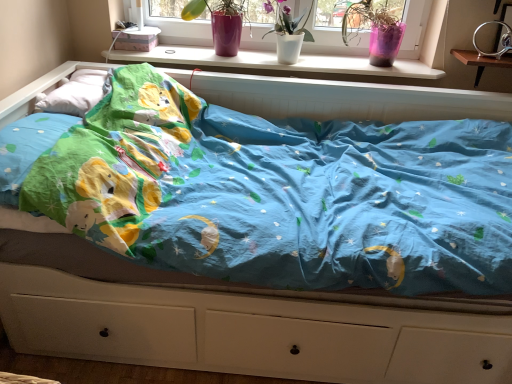
Describe the element at coordinates (287, 21) in the screenshot. I see `white matte vase at upper center, which is counted as the 2th floral arrangement, starting from the right` at that location.

Find the location of a particular element. This screenshot has height=384, width=512. white soft pillow at upper left is located at coordinates (75, 93).

At what (x,y) coordinates should I click in order to perform the action: click on white matte vase at upper center, which is counted as the 2th floral arrangement, starting from the right. Please return your answer as a coordinate pair (x, y). This screenshot has width=512, height=384. Looking at the image, I should click on (287, 21).

How different are the orientations of white plastic window sill at upper center and white soft pillow at upper left in degrees?

The angle between the facing direction of white plastic window sill at upper center and the facing direction of white soft pillow at upper left is 89.4 degrees.

Is the surface of white plastic window sill at upper center in direct contact with white soft pillow at upper left?

white plastic window sill at upper center and white soft pillow at upper left are clearly separated.

Is white plastic window sill at upper center taller or shorter than white soft pillow at upper left?

Considering their sizes, white plastic window sill at upper center has less height than white soft pillow at upper left.

Can you confirm if white plastic window sill at upper center is positioned to the left of white soft pillow at upper left?

No, white plastic window sill at upper center is not to the left of white soft pillow at upper left.

Considering the relative sizes of white matte vase at upper center, arranged as the 2th floral arrangement when viewed from the left, and white plastic window sill at upper center in the image provided, is white matte vase at upper center, arranged as the 2th floral arrangement when viewed from the left, smaller than white plastic window sill at upper center?

Correct, white matte vase at upper center, arranged as the 2th floral arrangement when viewed from the left, occupies less space than white plastic window sill at upper center.

From the image's perspective, which is below, white matte vase at upper center, arranged as the 2th floral arrangement when viewed from the left, or white plastic window sill at upper center?

white plastic window sill at upper center.

Can you confirm if white matte vase at upper center, arranged as the 2th floral arrangement when viewed from the left, is taller than white plastic window sill at upper center?

Yes.

Choose the correct answer: Is white matte vase at upper center, which is counted as the 2th floral arrangement, starting from the right, inside white plastic window sill at upper center or outside it?

white matte vase at upper center, which is counted as the 2th floral arrangement, starting from the right, cannot be found inside white plastic window sill at upper center.

Is white matte vase at upper center, which is counted as the 2th floral arrangement, starting from the right, smaller than pink plastic pot at upper right, which is the first floral arrangement from right to left?

Yes, white matte vase at upper center, which is counted as the 2th floral arrangement, starting from the right, is smaller than pink plastic pot at upper right, which is the first floral arrangement from right to left.

Which point is more distant from viewer, [306,41] or [348,38]?

The point [348,38] is behind.

Which is in front, white matte vase at upper center, arranged as the 2th floral arrangement when viewed from the left, or pink plastic pot at upper right, marked as the 3th floral arrangement in a left-to-right arrangement?

white matte vase at upper center, arranged as the 2th floral arrangement when viewed from the left.

Can you confirm if white matte vase at upper center, arranged as the 2th floral arrangement when viewed from the left, is wider than pink plastic pot at upper right, which is the first floral arrangement from right to left?

In fact, white matte vase at upper center, arranged as the 2th floral arrangement when viewed from the left, might be narrower than pink plastic pot at upper right, which is the first floral arrangement from right to left.

Does point (229, 38) come farther from viewer compared to point (477, 62)?

That is True.

Could you tell me if matte pink vase at upper center, arranged as the first floral arrangement when viewed from the left, is turned towards wooden changing table at upper right?

No, matte pink vase at upper center, arranged as the first floral arrangement when viewed from the left, is not aimed at wooden changing table at upper right.

Does matte pink vase at upper center, the third floral arrangement from the right, have a greater width compared to white plastic window sill at upper center?

Correct, the width of matte pink vase at upper center, the third floral arrangement from the right, exceeds that of white plastic window sill at upper center.

Does matte pink vase at upper center, arranged as the first floral arrangement when viewed from the left, appear on the right side of white plastic window sill at upper center?

In fact, matte pink vase at upper center, arranged as the first floral arrangement when viewed from the left, is to the left of white plastic window sill at upper center.

Could you tell me if matte pink vase at upper center, arranged as the first floral arrangement when viewed from the left, is facing white plastic window sill at upper center?

No, matte pink vase at upper center, arranged as the first floral arrangement when viewed from the left, is not aimed at white plastic window sill at upper center.

Measure the distance from matte pink vase at upper center, arranged as the first floral arrangement when viewed from the left, to white plastic window sill at upper center.

matte pink vase at upper center, arranged as the first floral arrangement when viewed from the left, and white plastic window sill at upper center are 23.45 centimeters apart from each other.

Which is less distant, (290, 70) or (490, 59)?

The point (490, 59) is closer.

Looking at this image, which object is closer to the camera, white plastic window sill at upper center or wooden changing table at upper right?

wooden changing table at upper right is more forward.

How much distance is there between white plastic window sill at upper center and wooden changing table at upper right?

They are 21.65 inches apart.

The width and height of the screenshot is (512, 384). Identify the location of window sill located above the wooden changing table at upper right (from the image's perspective). (274, 63).

Which of these two, pink plastic pot at upper right, which is the first floral arrangement from right to left, or matte pink vase at upper center, arranged as the first floral arrangement when viewed from the left, is wider?

matte pink vase at upper center, arranged as the first floral arrangement when viewed from the left, is wider.

Is pink plastic pot at upper right, which is the first floral arrangement from right to left, outside of matte pink vase at upper center, the third floral arrangement from the right?

Yes, pink plastic pot at upper right, which is the first floral arrangement from right to left, is located beyond the bounds of matte pink vase at upper center, the third floral arrangement from the right.

From a real-world perspective, does pink plastic pot at upper right, which is the first floral arrangement from right to left, stand above matte pink vase at upper center, arranged as the first floral arrangement when viewed from the left?

Indeed, from a real-world perspective, pink plastic pot at upper right, which is the first floral arrangement from right to left, stands above matte pink vase at upper center, arranged as the first floral arrangement when viewed from the left.

This screenshot has width=512, height=384. Identify the location of window sill behind the white soft pillow at upper left. (274, 63).

Locate an element on the screen. Image resolution: width=512 pixels, height=384 pixels. the 2nd floral arrangement in front of the white plastic window sill at upper center is located at coordinates (287, 21).

Looking at the image, which one is located further to matte pink vase at upper center, the third floral arrangement from the right, white plastic window sill at upper center or wooden changing table at upper right?

The object further to matte pink vase at upper center, the third floral arrangement from the right, is wooden changing table at upper right.

When comparing their distances from matte pink vase at upper center, the third floral arrangement from the right, does pink plastic pot at upper right, which is the first floral arrangement from right to left, or white matte vase at upper center, which is counted as the 2th floral arrangement, starting from the right, seem further?

Among the two, pink plastic pot at upper right, which is the first floral arrangement from right to left, is located further to matte pink vase at upper center, the third floral arrangement from the right.

From the image, which object appears to be nearer to white soft pillow at upper left, pink plastic pot at upper right, marked as the 3th floral arrangement in a left-to-right arrangement, or wooden changing table at upper right?

Among the two, pink plastic pot at upper right, marked as the 3th floral arrangement in a left-to-right arrangement, is located nearer to white soft pillow at upper left.

Consider the image. Which object lies further to the anchor point wooden changing table at upper right, white matte vase at upper center, arranged as the 2th floral arrangement when viewed from the left, or white soft pillow at upper left?

The object further to wooden changing table at upper right is white soft pillow at upper left.

From the image, which object appears to be farther from white matte vase at upper center, which is counted as the 2th floral arrangement, starting from the right, pink plastic pot at upper right, which is the first floral arrangement from right to left, or wooden changing table at upper right?

wooden changing table at upper right lies further to white matte vase at upper center, which is counted as the 2th floral arrangement, starting from the right, than the other object.

When comparing their distances from wooden changing table at upper right, does white matte vase at upper center, which is counted as the 2th floral arrangement, starting from the right, or white plastic window sill at upper center seem further?

The object further to wooden changing table at upper right is white matte vase at upper center, which is counted as the 2th floral arrangement, starting from the right.

From the image, which object appears to be farther from matte pink vase at upper center, the third floral arrangement from the right, white matte vase at upper center, which is counted as the 2th floral arrangement, starting from the right, or white plastic window sill at upper center?

The object further to matte pink vase at upper center, the third floral arrangement from the right, is white plastic window sill at upper center.

Looking at this image, based on their spatial positions, is pink plastic pot at upper right, marked as the 3th floral arrangement in a left-to-right arrangement, or white matte vase at upper center, which is counted as the 2th floral arrangement, starting from the right, further from white soft pillow at upper left?

pink plastic pot at upper right, marked as the 3th floral arrangement in a left-to-right arrangement, is further to white soft pillow at upper left.

At what (x,y) coordinates should I click in order to perform the action: click on floral arrangement between white matte vase at upper center, which is counted as the 2th floral arrangement, starting from the right, and wooden changing table at upper right, in the horizontal direction. Please return your answer as a coordinate pair (x, y). The height and width of the screenshot is (384, 512). Looking at the image, I should click on (374, 31).

Where is `window sill between matte pink vase at upper center, the third floral arrangement from the right, and white matte vase at upper center, arranged as the 2th floral arrangement when viewed from the left, from left to right`? window sill between matte pink vase at upper center, the third floral arrangement from the right, and white matte vase at upper center, arranged as the 2th floral arrangement when viewed from the left, from left to right is located at coordinates (274, 63).

The width and height of the screenshot is (512, 384). Find the location of `floral arrangement located between white soft pillow at upper left and white plastic window sill at upper center in the left-right direction`. floral arrangement located between white soft pillow at upper left and white plastic window sill at upper center in the left-right direction is located at coordinates (220, 23).

What are the coordinates of `window sill between white soft pillow at upper left and white matte vase at upper center, arranged as the 2th floral arrangement when viewed from the left, in the horizontal direction` in the screenshot? It's located at (274, 63).